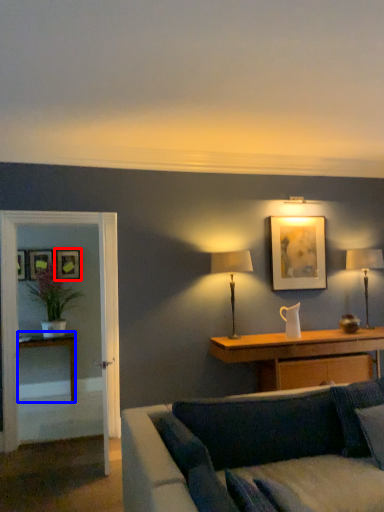
Question: Which point is closer to the camera, picture frame (highlighted by a red box) or table (highlighted by a blue box)?

Choices:
 (A) picture frame
 (B) table

Answer: (B)